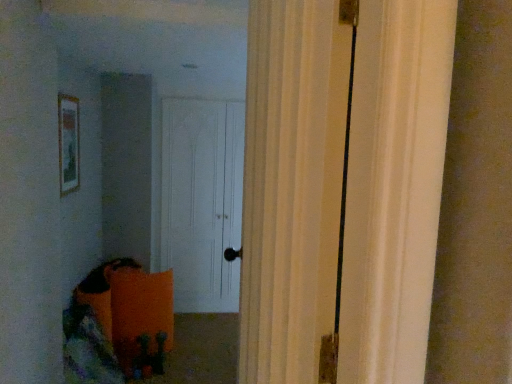
Measure the distance between point (197, 250) and camera.

Point (197, 250) is 3.84 meters away from camera.

At what (x,y) coordinates should I click in order to perform the action: click on white matte door at center. Please return your answer as a coordinate pair (x, y). The height and width of the screenshot is (384, 512). Looking at the image, I should click on (202, 201).

The image size is (512, 384). Describe the element at coordinates (202, 201) in the screenshot. I see `white matte door at center` at that location.

What is the approximate height of wooden framed picture at upper left?

It is 59.16 centimeters.

Locate an element on the screen. This screenshot has height=384, width=512. wooden framed picture at upper left is located at coordinates (68, 143).

This screenshot has width=512, height=384. Describe the element at coordinates (68, 143) in the screenshot. I see `wooden framed picture at upper left` at that location.

Where is `white matte door at center`? This screenshot has width=512, height=384. white matte door at center is located at coordinates (202, 201).

Considering the relative positions of white matte door at center and wooden framed picture at upper left in the image provided, is white matte door at center to the left or to the right of wooden framed picture at upper left?

In the image, white matte door at center appears on the right side of wooden framed picture at upper left.

Who is more distant, white matte door at center or wooden framed picture at upper left?

white matte door at center is further from the camera.

Which is closer, (x=241, y=219) or (x=77, y=101)?

The point (x=77, y=101) is closer.

From the image's perspective, is white matte door at center on wooden framed picture at upper left?

No, from the image's perspective, white matte door at center is not on top of wooden framed picture at upper left.

From a real-world perspective, which object stands above the other?

From a 3D spatial view, wooden framed picture at upper left is above.

Between white matte door at center and wooden framed picture at upper left, which one has smaller width?

wooden framed picture at upper left is thinner.

Can you confirm if white matte door at center is shorter than wooden framed picture at upper left?

No.

Can you confirm if white matte door at center is bigger than wooden framed picture at upper left?

Correct, white matte door at center is larger in size than wooden framed picture at upper left.

Is white matte door at center situated inside wooden framed picture at upper left or outside?

white matte door at center is outside wooden framed picture at upper left.

Is white matte door at center with wooden framed picture at upper left?

No, white matte door at center is not making contact with wooden framed picture at upper left.

Could you tell me if white matte door at center is facing wooden framed picture at upper left?

No, white matte door at center is not aimed at wooden framed picture at upper left.

Measure the distance from white matte door at center to wooden framed picture at upper left.

4.89 feet.

Image resolution: width=512 pixels, height=384 pixels. In order to click on door lying behind the wooden framed picture at upper left in this screenshot , I will do `click(202, 201)`.

Is wooden framed picture at upper left at the right side of white matte door at center?

No, wooden framed picture at upper left is not to the right of white matte door at center.

Is the depth of wooden framed picture at upper left greater than that of white matte door at center?

No, it is not.

Considering the points (58, 108) and (221, 277), which point is in front, point (58, 108) or point (221, 277)?

Point (58, 108)

From the image's perspective, is wooden framed picture at upper left located above white matte door at center?

Yes.

From a real-world perspective, relative to white matte door at center, is wooden framed picture at upper left vertically above or below?

wooden framed picture at upper left is above white matte door at center.

In terms of width, does wooden framed picture at upper left look wider or thinner when compared to white matte door at center?

In the image, wooden framed picture at upper left appears to be more narrow than white matte door at center.

Considering the relative sizes of wooden framed picture at upper left and white matte door at center in the image provided, is wooden framed picture at upper left taller than white matte door at center?

Incorrect, the height of wooden framed picture at upper left is not larger of that of white matte door at center.

Considering the sizes of objects wooden framed picture at upper left and white matte door at center in the image provided, who is bigger, wooden framed picture at upper left or white matte door at center?

With larger size is white matte door at center.

Consider the image. Is wooden framed picture at upper left situated inside white matte door at center or outside?

wooden framed picture at upper left exists outside the volume of white matte door at center.

Are wooden framed picture at upper left and white matte door at center beside each other?

No, wooden framed picture at upper left is not making contact with white matte door at center.

Is wooden framed picture at upper left looking in the opposite direction of white matte door at center?

wooden framed picture at upper left is not turned away from white matte door at center.

How distant is wooden framed picture at upper left from white matte door at center?

1.49 meters.

Where is `picture frame on the left of white matte door at center`? picture frame on the left of white matte door at center is located at coordinates (68, 143).

Identify the location of picture frame located above the white matte door at center (from a real-world perspective). The height and width of the screenshot is (384, 512). (68, 143).

The height and width of the screenshot is (384, 512). Identify the location of picture frame that appears on the left of white matte door at center. (68, 143).